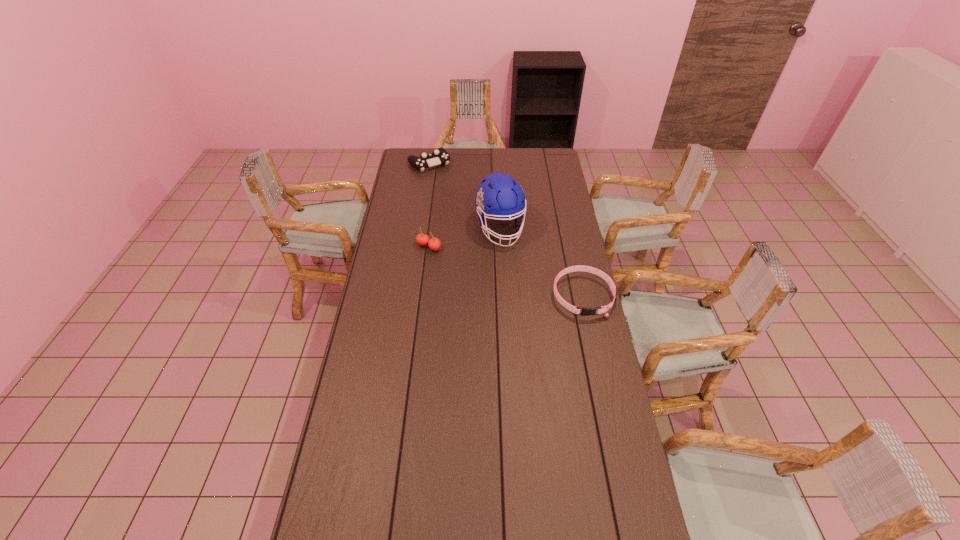
You are a GUI agent. You are given a task and a screenshot of the screen. Output one action in this format:
    pyautogui.click(x=<x>, y=<y>)
    Task: Click on the blank area at the far edge
    The height and width of the screenshot is (540, 960).
    Given the screenshot: What is the action you would take?
    pyautogui.click(x=518, y=167)

The image size is (960, 540). In order to click on vacant region at the left edge in this screenshot , I will do `click(376, 360)`.

The image size is (960, 540). Identify the location of free space at the right edge of the desktop. (619, 434).

The height and width of the screenshot is (540, 960). Identify the location of vacant space at the far left corner of the desktop. (402, 152).

Where is `free point between the cherry and the football helmet`? The width and height of the screenshot is (960, 540). free point between the cherry and the football helmet is located at coordinates (465, 238).

Locate an element on the screen. free space between the third shortest object and the tallest object is located at coordinates (465, 238).

Image resolution: width=960 pixels, height=540 pixels. Find the location of `empty space that is in between the second shortest object and the dog collar`. empty space that is in between the second shortest object and the dog collar is located at coordinates (506, 230).

The height and width of the screenshot is (540, 960). In order to click on free space between the dog collar and the football helmet in this screenshot , I will do `click(541, 262)`.

The width and height of the screenshot is (960, 540). Find the location of `vacant region between the third tallest object and the third object from left to right`. vacant region between the third tallest object and the third object from left to right is located at coordinates (465, 196).

Identify the location of empty space between the shortest object and the second object from right to left. (541, 262).